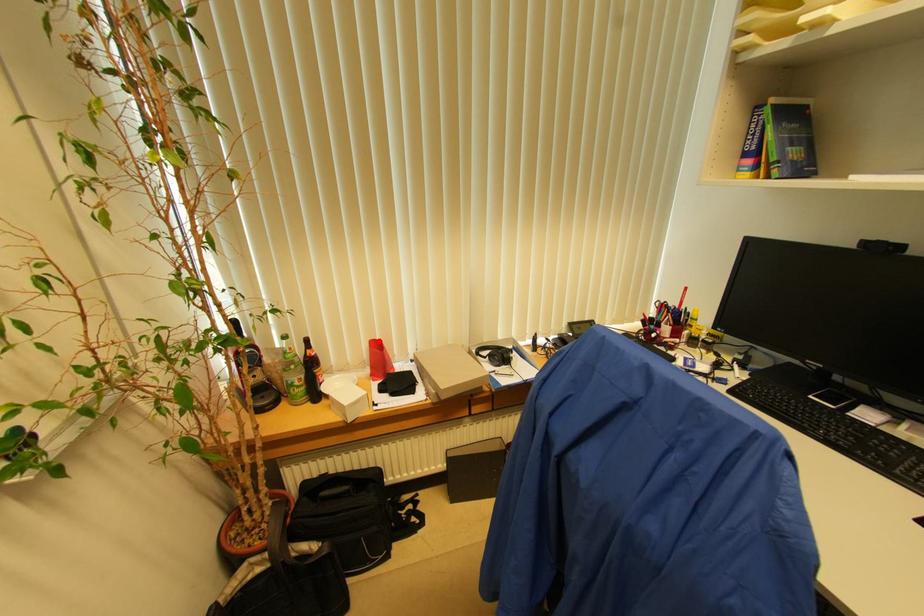
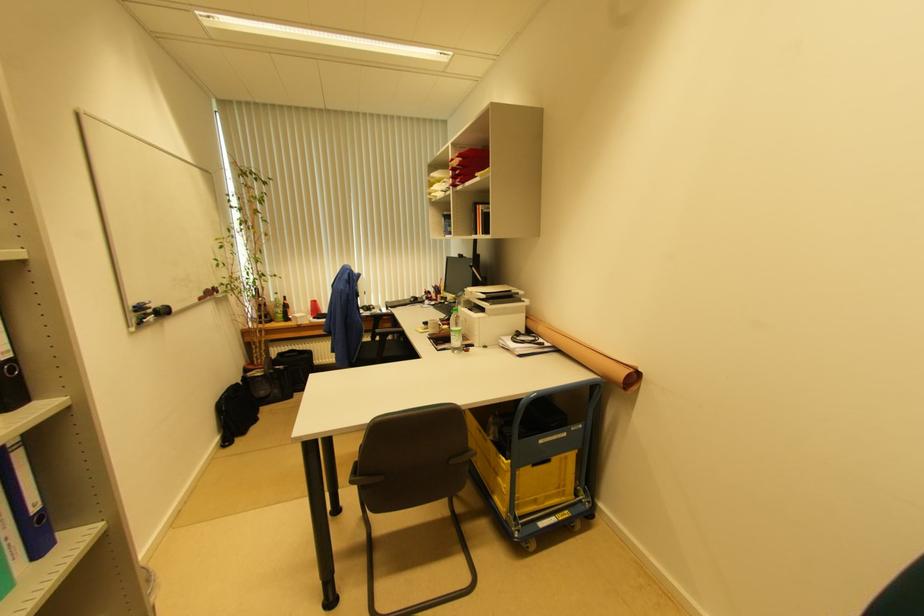
Question: I am providing you with two images of the same scene from different viewpoints. A red point is marked on the first image. Is the red point's position out of view in image 2?

Choices:
 (A) Yes
 (B) No

Answer: (B)